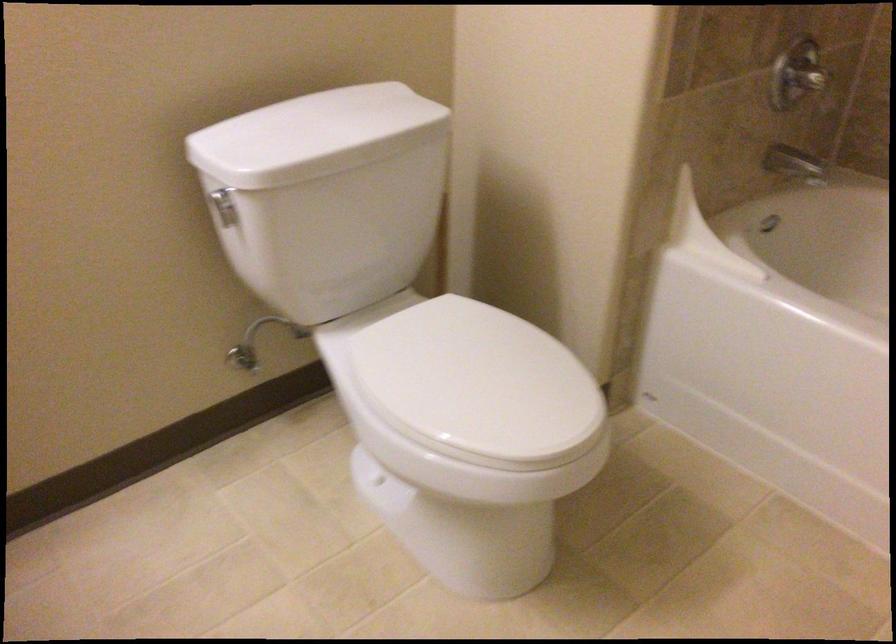
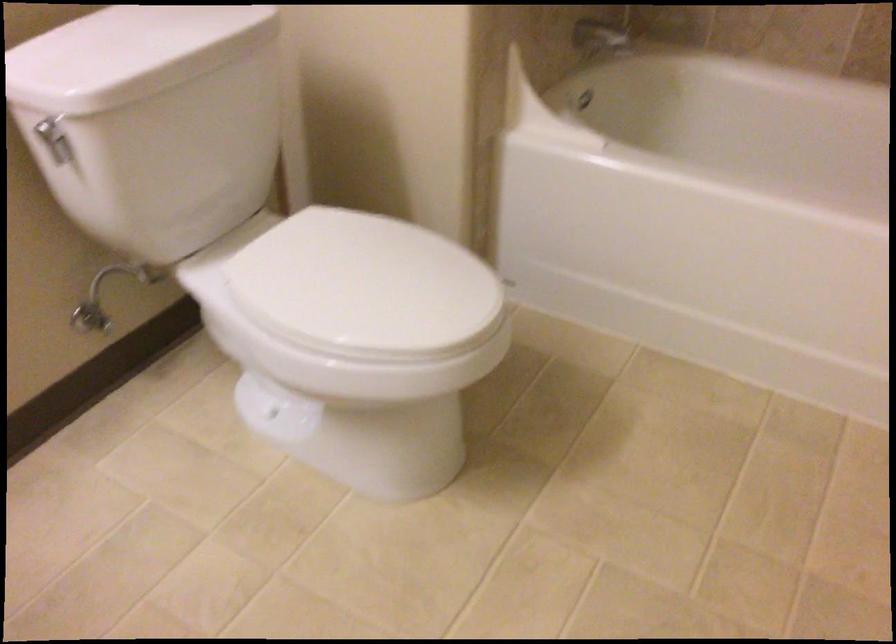
Question: How did the camera likely rotate?

Choices:
 (A) Left
 (B) Right
 (C) Up
 (D) Down

Answer: (B)